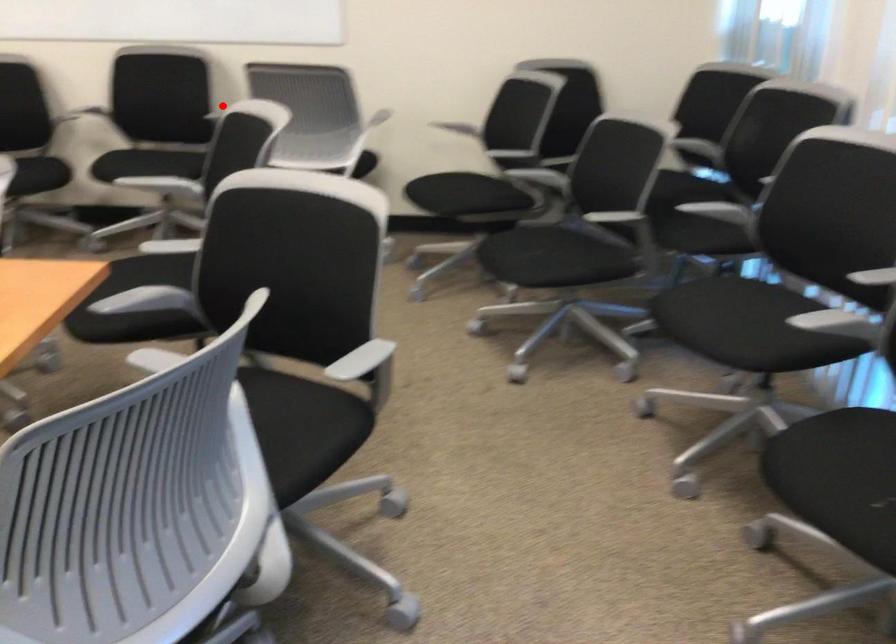
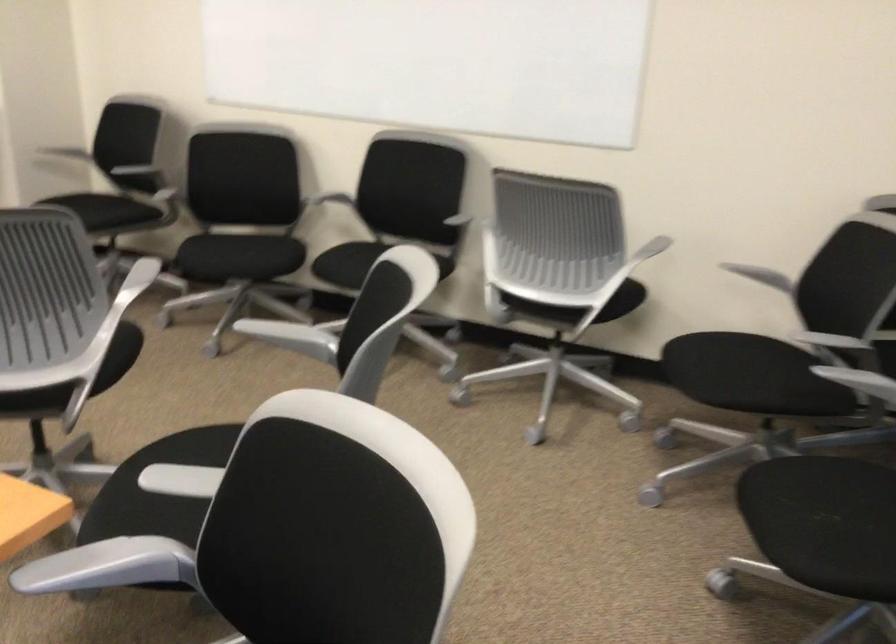
Find the pixel in the second image that matches the highlighted location in the first image.

(469, 207)